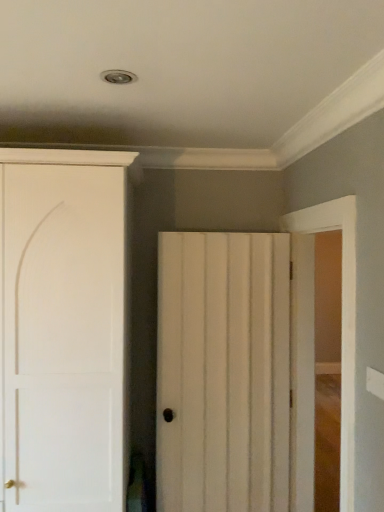
Question: Can you confirm if white wood door at center, arranged as the 2th door when viewed from the left, is thinner than white matte door at left, which ranks as the first door in left-to-right order?

Choices:
 (A) no
 (B) yes

Answer: (B)

Question: Considering the relative sizes of white wood door at center, arranged as the 1th door when viewed from the right, and white matte door at left, the second door positioned from the right, in the image provided, is white wood door at center, arranged as the 1th door when viewed from the right, smaller than white matte door at left, the second door positioned from the right,?

Choices:
 (A) yes
 (B) no

Answer: (A)

Question: Could you tell me if white wood door at center, arranged as the 1th door when viewed from the right, is facing white matte door at left, the second door positioned from the right?

Choices:
 (A) yes
 (B) no

Answer: (B)

Question: From the image's perspective, would you say white wood door at center, arranged as the 1th door when viewed from the right, is positioned over white matte door at left, the second door positioned from the right?

Choices:
 (A) no
 (B) yes

Answer: (A)

Question: Is white wood door at center, arranged as the 2th door when viewed from the left, completely or partially outside of white matte door at left, the second door positioned from the right?

Choices:
 (A) no
 (B) yes

Answer: (B)

Question: Is white wood door at center, arranged as the 1th door when viewed from the right, closer to the viewer compared to white matte door at left, the second door positioned from the right?

Choices:
 (A) yes
 (B) no

Answer: (B)

Question: Is white matte door at left, which ranks as the first door in left-to-right order, not inside white wood door at center, arranged as the 1th door when viewed from the right?

Choices:
 (A) yes
 (B) no

Answer: (A)

Question: From a real-world perspective, is white matte door at left, the second door positioned from the right, beneath white wood door at center, arranged as the 2th door when viewed from the left?

Choices:
 (A) yes
 (B) no

Answer: (B)

Question: Would you consider white matte door at left, the second door positioned from the right, to be distant from white wood door at center, arranged as the 2th door when viewed from the left?

Choices:
 (A) no
 (B) yes

Answer: (A)

Question: Can you confirm if white matte door at left, which ranks as the first door in left-to-right order, is taller than white wood door at center, arranged as the 1th door when viewed from the right?

Choices:
 (A) no
 (B) yes

Answer: (B)

Question: Does white matte door at left, which ranks as the first door in left-to-right order, have a lesser width compared to white wood door at center, arranged as the 2th door when viewed from the left?

Choices:
 (A) yes
 (B) no

Answer: (B)

Question: Is white matte door at left, the second door positioned from the right, surrounding white wood door at center, arranged as the 1th door when viewed from the right?

Choices:
 (A) no
 (B) yes

Answer: (A)

Question: Is point (225, 343) closer or farther from the camera than point (92, 183)?

Choices:
 (A) closer
 (B) farther

Answer: (B)